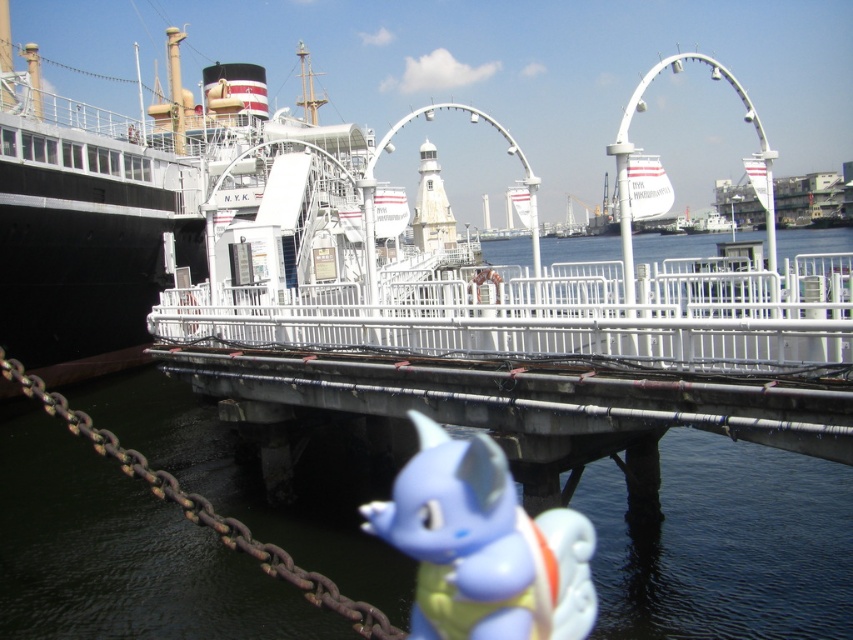
Measure the distance from white metal bridge at center to blue rubber toy at lower center.

white metal bridge at center and blue rubber toy at lower center are 21.54 feet apart from each other.

How distant is white metal bridge at center from blue rubber toy at lower center?

white metal bridge at center is 6.56 meters away from blue rubber toy at lower center.

The height and width of the screenshot is (640, 853). What are the coordinates of `white metal bridge at center` in the screenshot? It's located at click(x=541, y=353).

Is point (103, 276) farther from viewer compared to point (360, 609)?

That is True.

Which is behind, point (10, 129) or point (38, 387)?

Positioned behind is point (10, 129).

Who is more forward, (178, 212) or (335, 598)?

Point (335, 598) is in front.

The image size is (853, 640). I want to click on black polished steel cruise ship at left, so click(169, 211).

Which is behind, point (369, 563) or point (265, 561)?

Positioned behind is point (369, 563).

What do you see at coordinates (726, 545) in the screenshot?
I see `transparent water at center` at bounding box center [726, 545].

Identify the location of transparent water at center. (726, 545).